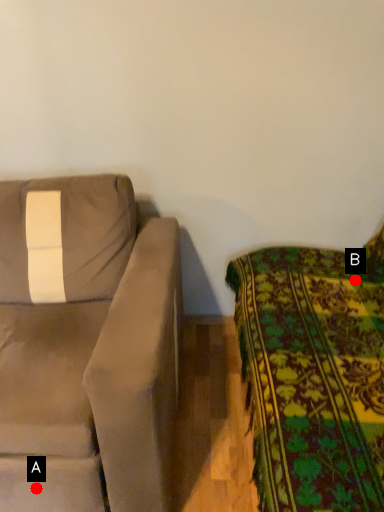
Question: Two points are circled on the image, labeled by A and B beside each circle. Among these points, which one is nearest to the camera?

Choices:
 (A) A is closer
 (B) B is closer

Answer: (A)